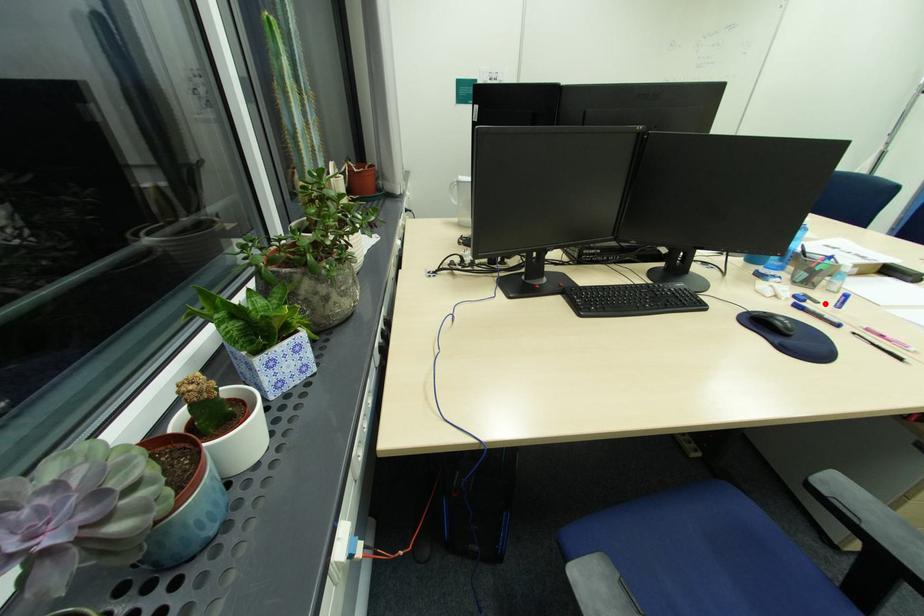
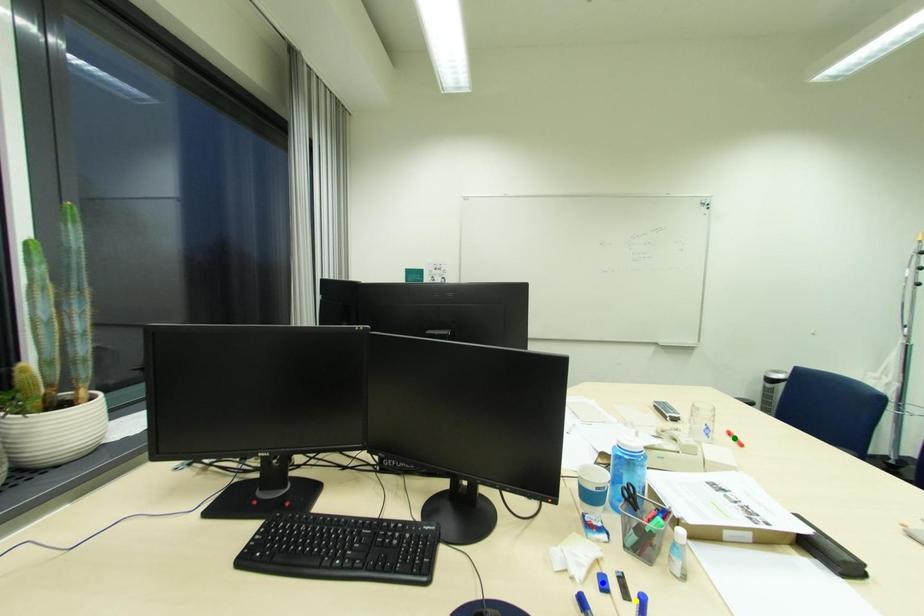
Question: I am providing you with two images of the same scene from different viewpoints. A red point is marked on the first image. You are given multiple points on the second image. Which point in image 2 is actually the same real-world point as the red point in image 1?

Choices:
 (A) yellow point
 (B) green point
 (C) blue point

Answer: (A)